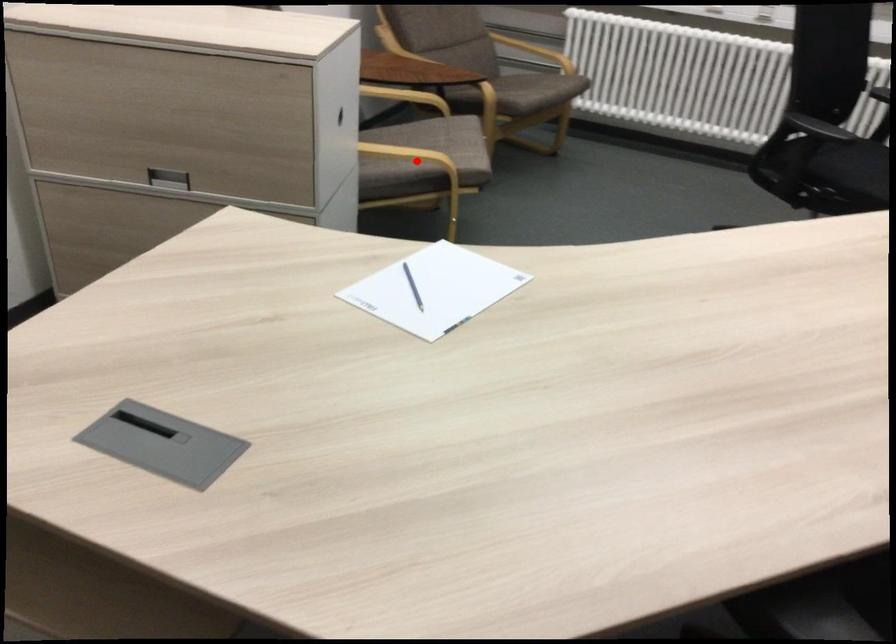
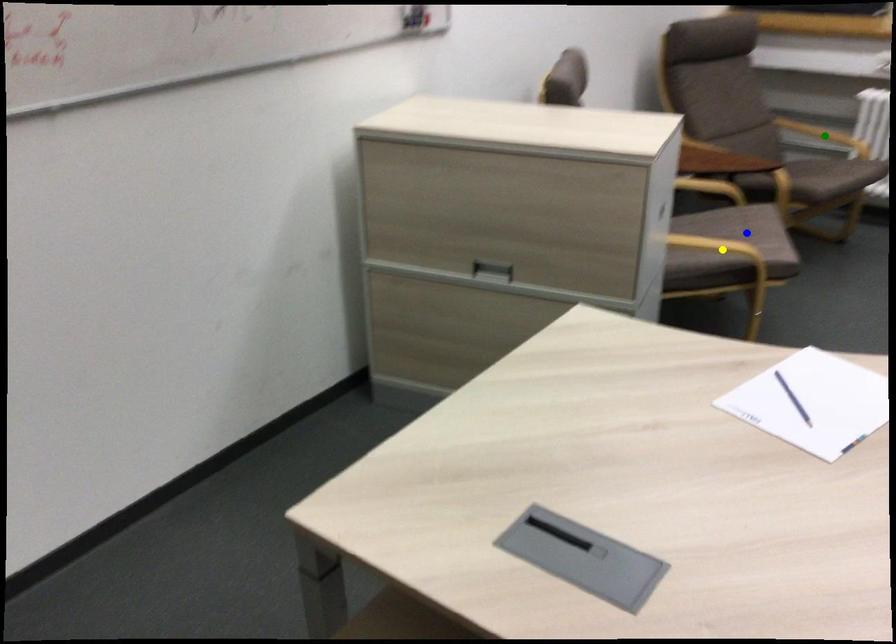
Question: I am providing you with two images of the same scene from different viewpoints. A red point is marked on the first image. You are given multiple points on the second image. Which spot in image 2 lines up with the point in image 1?

Choices:
 (A) blue point
 (B) green point
 (C) yellow point

Answer: (C)